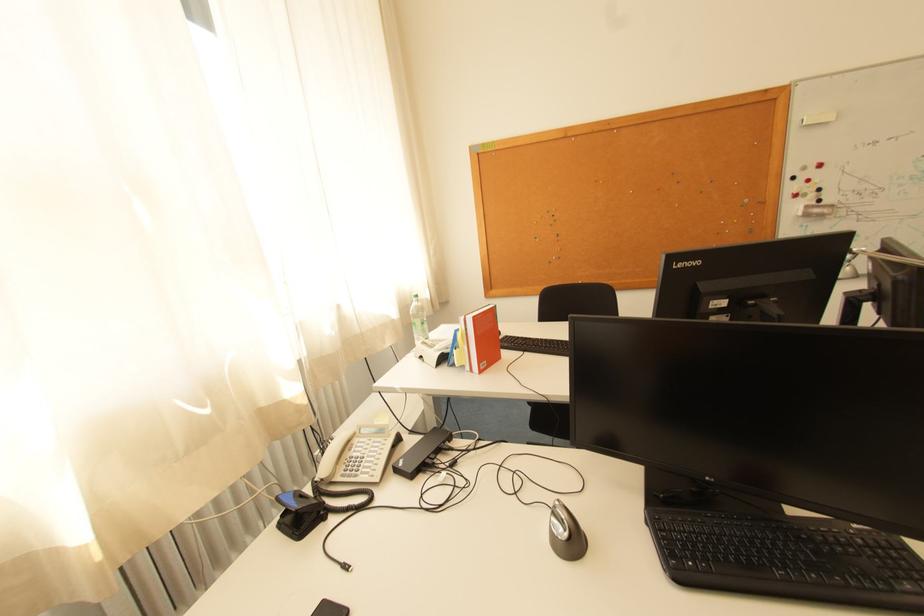
What do you see at coordinates (783, 554) in the screenshot? This screenshot has width=924, height=616. I see `the phone keypad buttons` at bounding box center [783, 554].